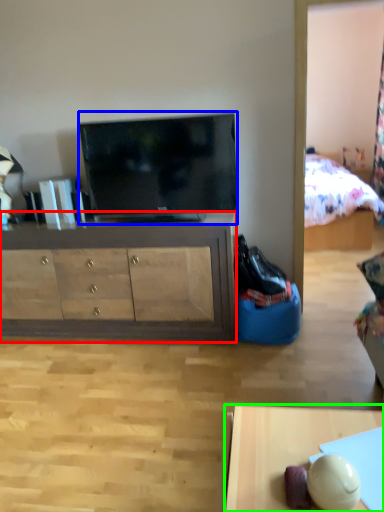
Question: Considering the real-world distances, which object is closest to cabinetry (highlighted by a red box)? television (highlighted by a blue box) or desk (highlighted by a green box).

Choices:
 (A) television
 (B) desk

Answer: (A)